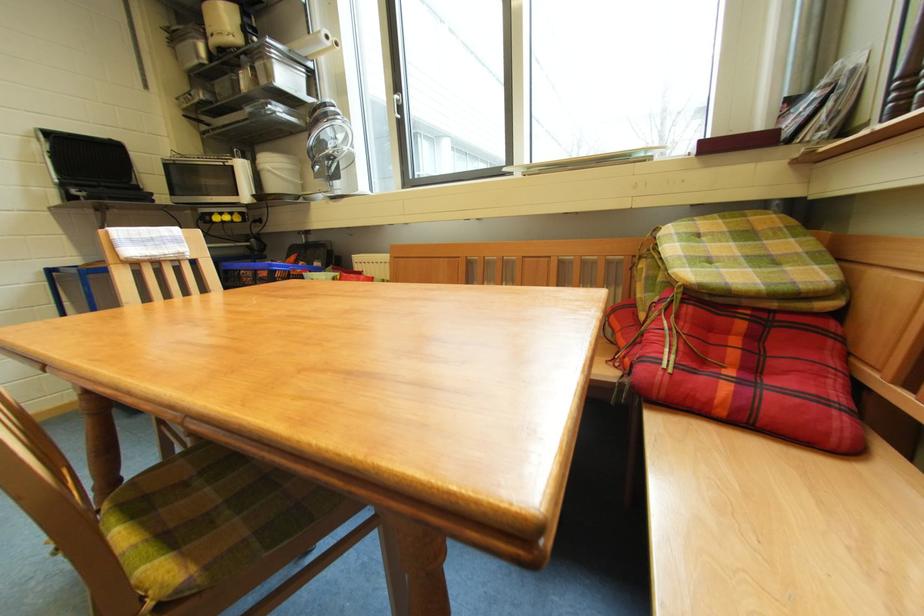
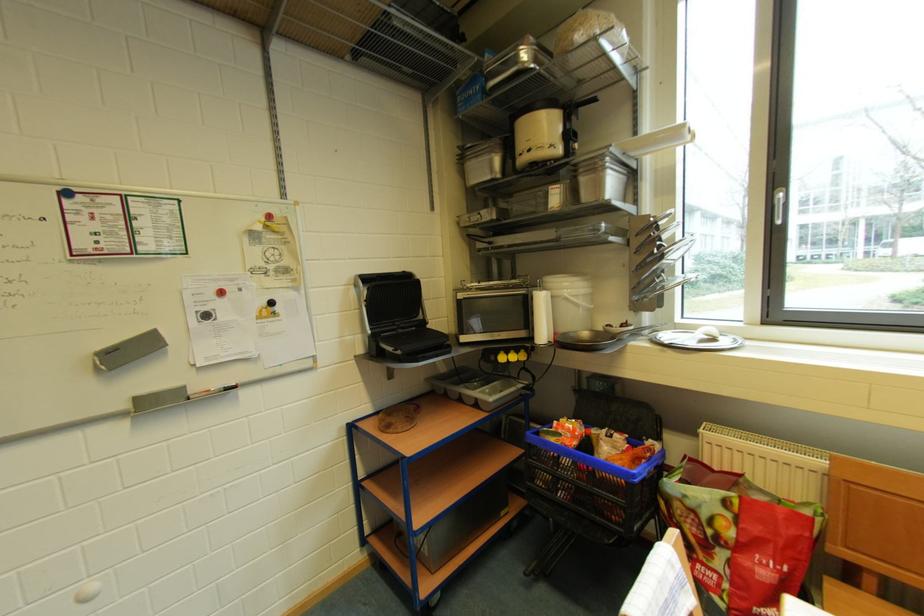
The point at (x=263, y=61) is marked in the first image. Where is the corresponding point in the second image?

(589, 174)